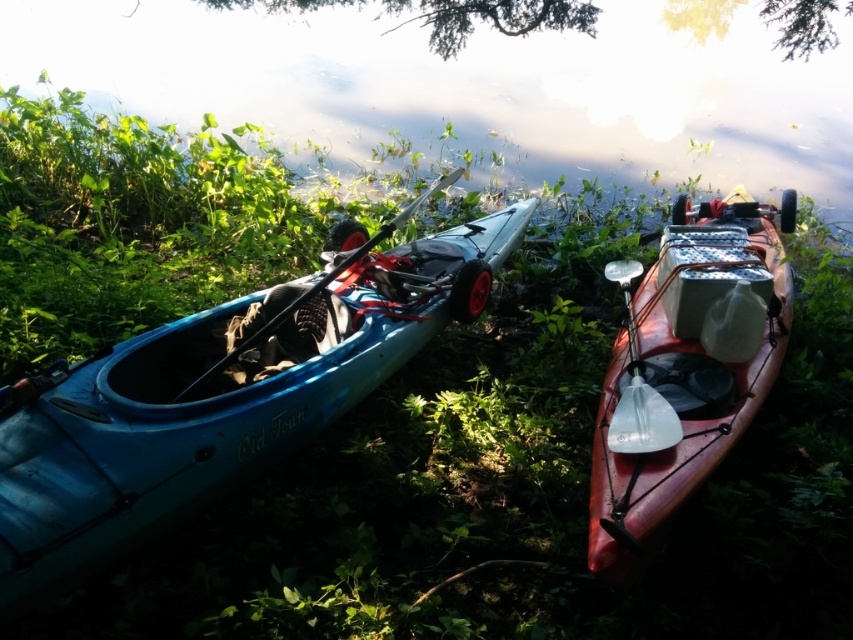
The image size is (853, 640). Describe the element at coordinates (218, 396) in the screenshot. I see `blue plastic kayak at left` at that location.

Consider the image. Measure the distance between point (467, 268) and camera.

Point (467, 268) is 9.91 feet from camera.

Identify the location of blue plastic kayak at left. click(x=218, y=396).

Who is higher up, blue plastic kayak at left or matte black paddle at center?

Positioned higher is matte black paddle at center.

Is blue plastic kayak at left thinner than matte black paddle at center?

No, blue plastic kayak at left is not thinner than matte black paddle at center.

Does point (523, 228) lie behind point (263, 333)?

That is True.

Identify the location of blue plastic kayak at left. (218, 396).

Describe the element at coordinates (218, 396) in the screenshot. Image resolution: width=853 pixels, height=640 pixels. I see `blue plastic kayak at left` at that location.

Describe the element at coordinates (218, 396) in the screenshot. I see `blue plastic kayak at left` at that location.

In order to click on blue plastic kayak at left in this screenshot , I will do `click(218, 396)`.